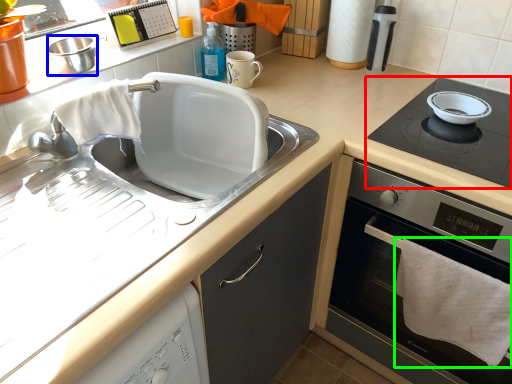
Question: Based on their relative distances, which object is farther from gas stove (highlighted by a red box)? Choose from appliance (highlighted by a blue box) and bath towel (highlighted by a green box).

Choices:
 (A) appliance
 (B) bath towel

Answer: (A)